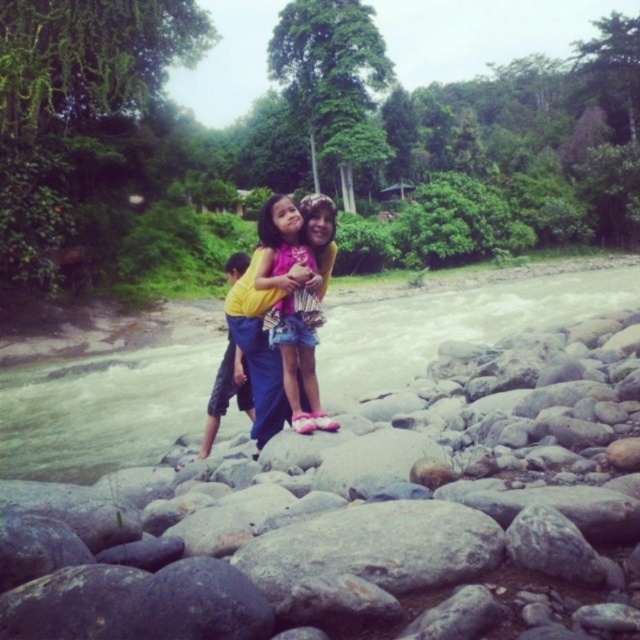
You are planning to place a small picnic basket on the smooth gray rock at center. However, you need to ensure it won not fall into the clear water at stream center. Based on the scene, is the rock a stable place for the basket?

The smooth gray rock at center is in front of the clear water at stream center, meaning the rock is positioned closer to you and away from the flowing water. Therefore, placing the picnic basket on the smooth gray rock at center should be stable and safe from the water.

You are planning to place a small picnic basket on the smooth gray rock at center. Considering the size of the rock compared to the clear water at stream center, will the basket fit comfortably?

The smooth gray rock at center is smaller than the clear water at stream center. Since the rock is smaller, the picnic basket might not fit comfortably unless it is very small.

You are standing at the riverbank and want to take a photo of the two points mentioned. Which point, point (x=362, y=488) or point (x=417, y=372), will appear larger in your camera view?

Point (x=362, y=488) will appear larger in the camera view because it is closer to the camera than point (x=417, y=372).